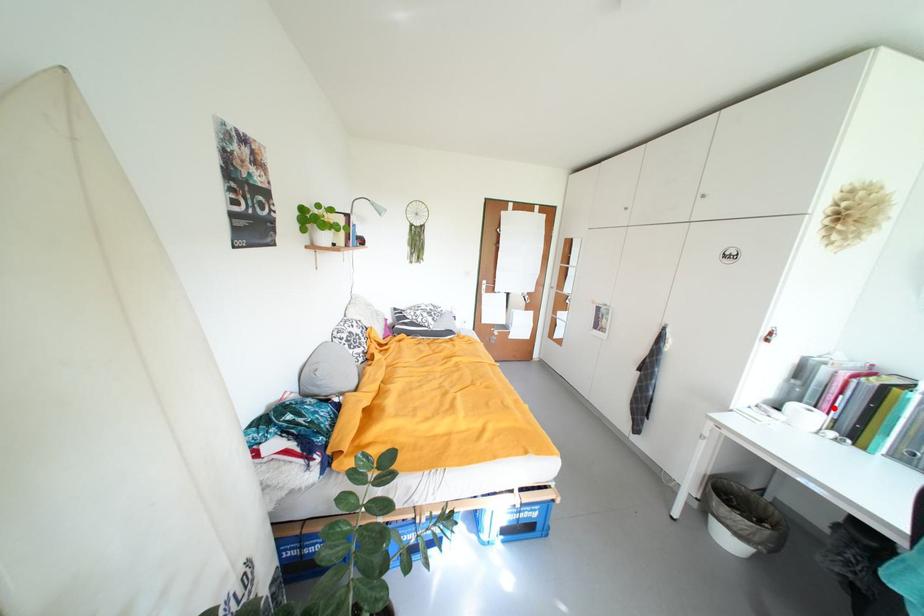
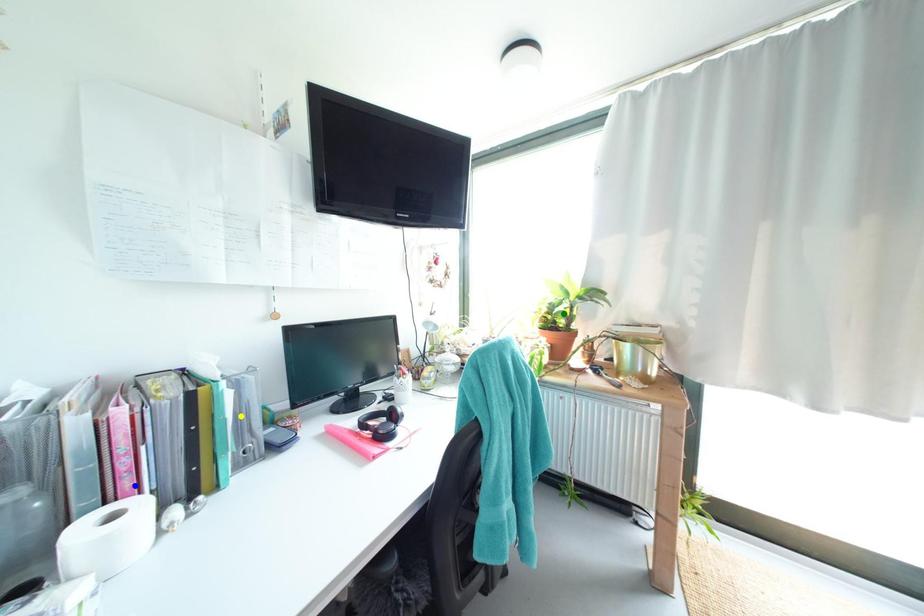
Question: I am providing you with two images of the same scene from different viewpoints. A red point is marked on the first image. You are given multiple points on the second image. Which mark in image 2 goes with the point in image 1?

Choices:
 (A) green point
 (B) blue point
 (C) yellow point

Answer: (B)